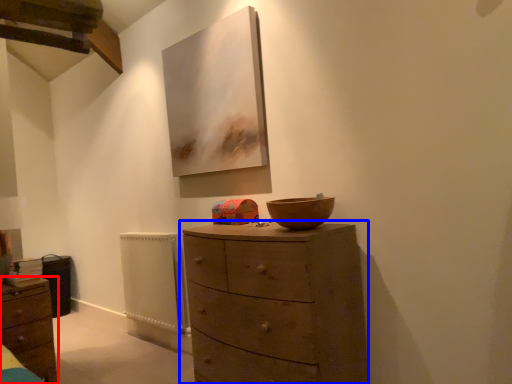
Question: Which object is closer to the camera taking this photo, chest of drawers (highlighted by a red box) or chest of drawers (highlighted by a blue box)?

Choices:
 (A) chest of drawers
 (B) chest of drawers

Answer: (B)